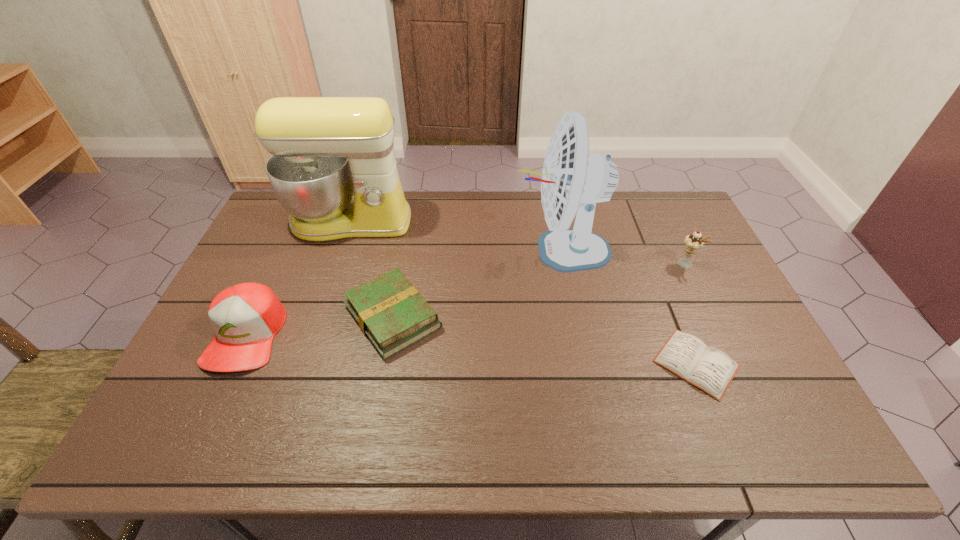
Locate an element on the screen. The width and height of the screenshot is (960, 540). free space that satisfies the following two spatial constraints: 1. on the back side of the diary; 2. on the grille of the fan is located at coordinates (650, 251).

Locate an element on the screen. Image resolution: width=960 pixels, height=540 pixels. vacant region that satisfies the following two spatial constraints: 1. on the grille of the third object from right to left; 2. on the front side of the fifth tallest object is located at coordinates (574, 317).

Image resolution: width=960 pixels, height=540 pixels. In order to click on free space that satisfies the following two spatial constraints: 1. on the side of the diary with the control knob; 2. on the left side of the mixer in this screenshot , I will do `click(302, 363)`.

Locate an element on the screen. The image size is (960, 540). vacant space that satisfies the following two spatial constraints: 1. on the side of the mixer with the control knob; 2. on the left side of the diary is located at coordinates (302, 363).

Locate an element on the screen. vacant area that satisfies the following two spatial constraints: 1. on the side of the mixer with the control knob; 2. on the right side of the second shortest object is located at coordinates (318, 317).